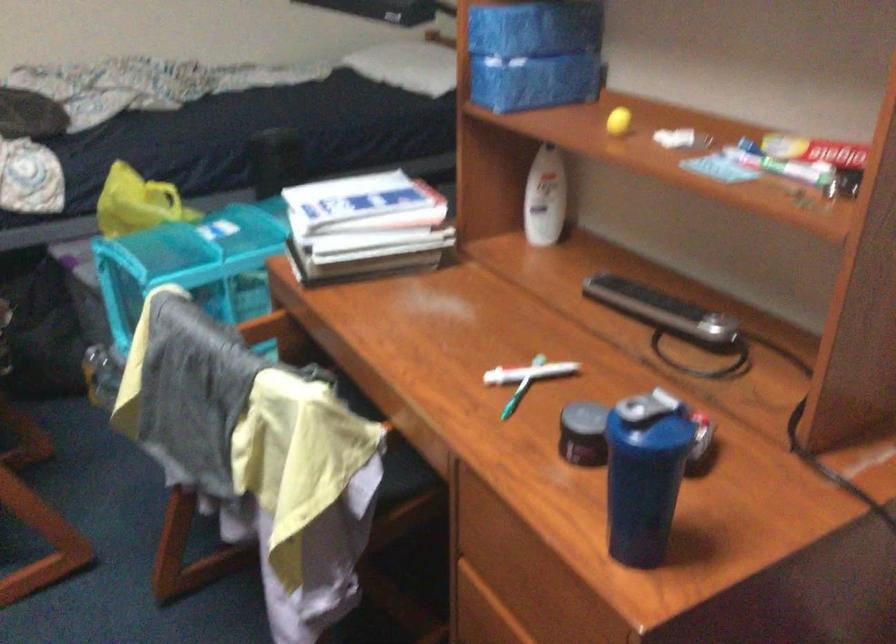
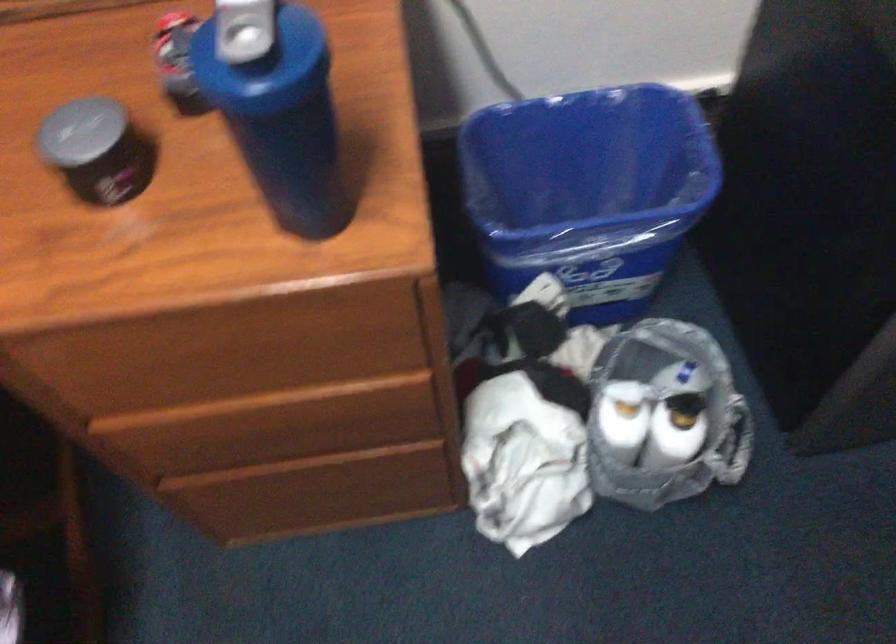
The images are taken continuously from a first-person perspective. In which direction is your viewpoint rotating?

The camera's rotation is toward right-down.